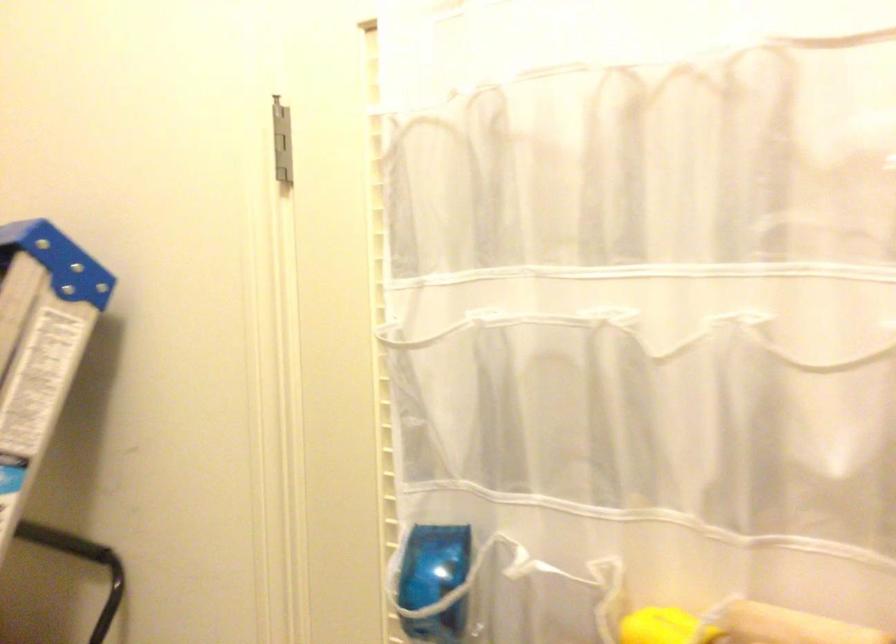
Question: The first image is from the beginning of the video and the second image is from the end. How did the camera likely rotate when shooting the video?

Choices:
 (A) Left
 (B) Right
 (C) Up
 (D) Down

Answer: (A)